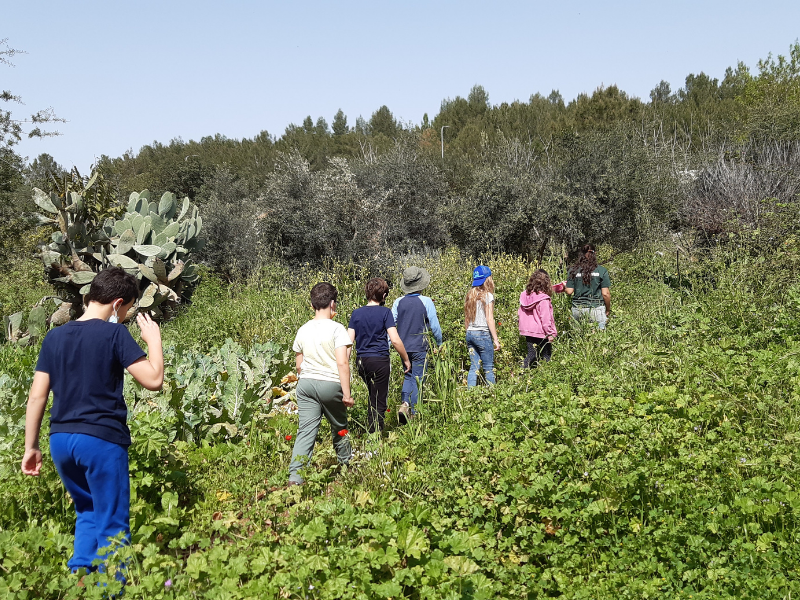
The image size is (800, 600). What are the coordinates of `green plants` in the screenshot? It's located at (145, 234), (606, 484), (572, 156).